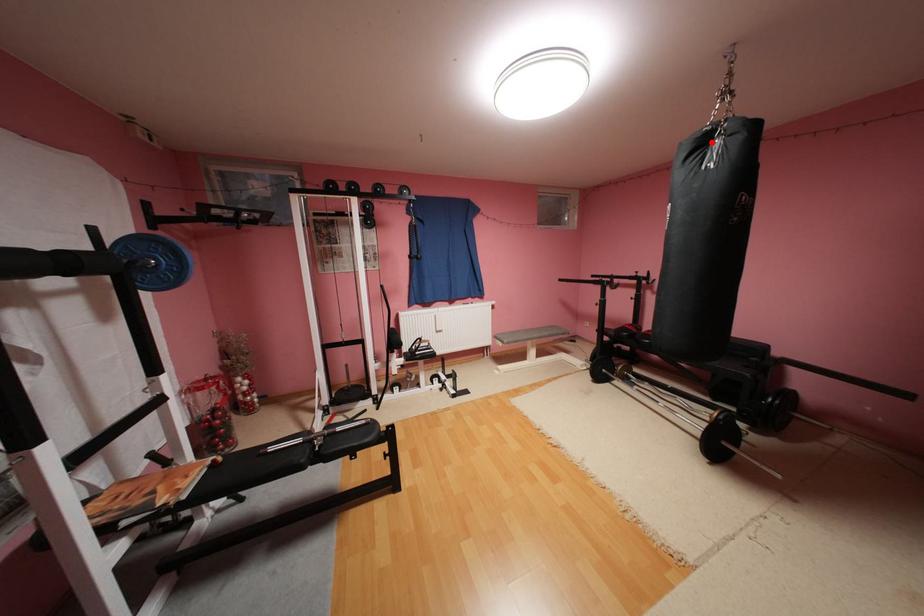
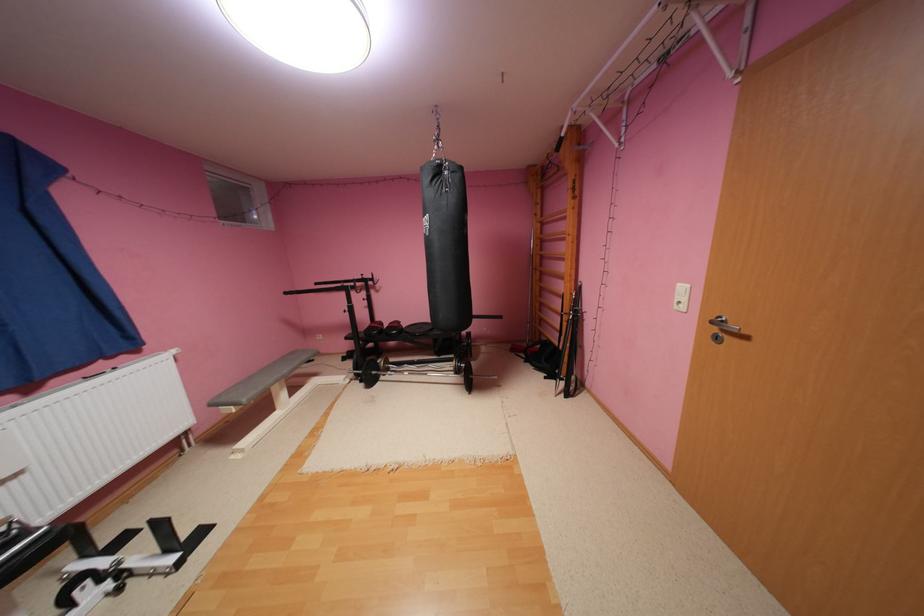
Question: A red point is marked in image1. In image2, is the corresponding 3D point closer to the camera or farther? Reply with the corresponding letter.

Choices:
 (A) The corresponding 3D point is closer.
 (B) The corresponding 3D point is farther.

Answer: (A)